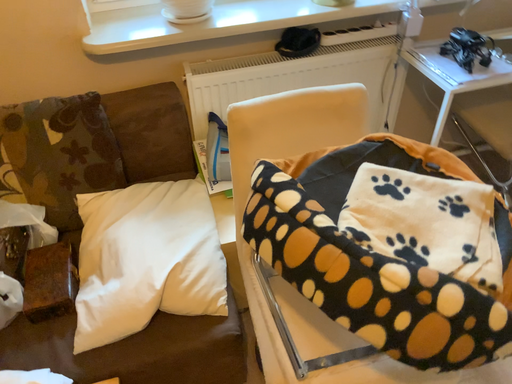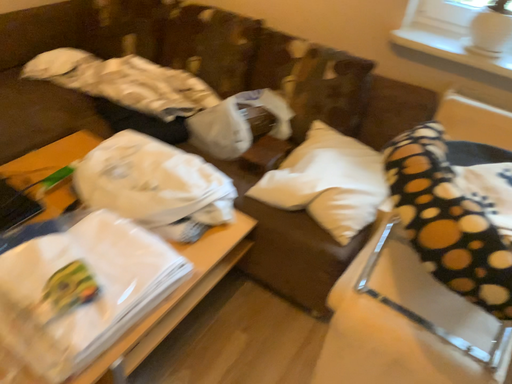
Question: How did the camera likely rotate when shooting the video?

Choices:
 (A) rotated right
 (B) rotated left

Answer: (B)